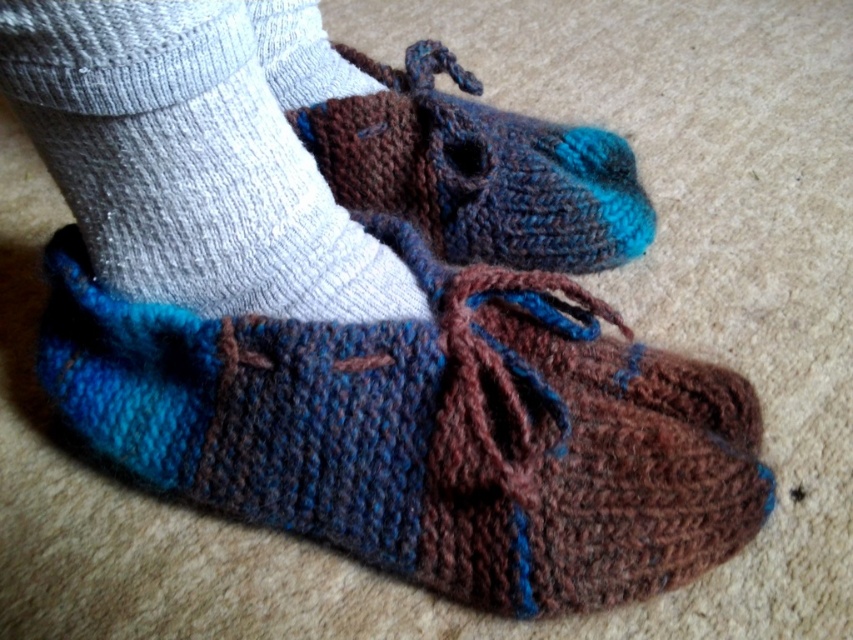
You are a delivery robot with a 6 inch wide package. You need to move from the blue knitted moccasin at center to the knitted wool sock at lower left. Can you fit through the space between them?

The blue knitted moccasin at center and knitted wool sock at lower left are 5.25 inches apart from each other. Since the package is 6 inches wide, it cannot fit through the space between them.

You are standing in front of the beige carpet and see two points marked on the floor. The first point is at coordinates point [743,500] and the second is at point [485,120]. If you want to walk from the first point to the second point, which direction should you move in relation to the beige carpet?

You should move backward because point [743,500] is in front of point [485,120], so moving from the first to the second requires going backward relative to your current facing direction.

You are designing a shoe display and need to arrange the blue knitted moccasin at center and the knitted woolen moccasin at center on a shelf. The shelf has a height limit of 10 cm. Can both moccasins be placed on the shelf without exceeding the height limit?

The blue knitted moccasin at center is taller than the knitted woolen moccasin at center. However, since the height limit is 10 cm and the description only states their relative heights, we cannot determine if both will fit without knowing their exact heights. Additional measurements are needed.